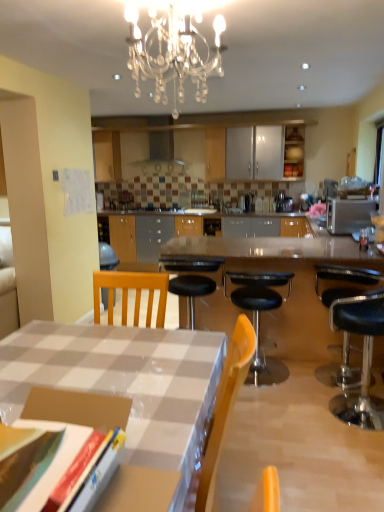
Question: Is polished granite table at center wider or thinner than matte wood cabinet at upper center?

Choices:
 (A) thin
 (B) wide

Answer: (B)

Question: From their relative heights in the image, would you say polished granite table at center is taller or shorter than matte wood cabinet at upper center?

Choices:
 (A) short
 (B) tall

Answer: (B)

Question: Based on their relative distances, which object is farther from the crystal glass chandelier at upper center?

Choices:
 (A) polished granite table at center
 (B) satin silver metallic exhaust hood at upper center
 (C) black leather stool at right, the 2th chair in the left-to-right sequence
 (D) white glossy desk at lower left
 (E) silver metallic microwave at right

Answer: (B)

Question: Which object is the closest to the black leather stool at right, the 1th chair in the right-to-left sequence?

Choices:
 (A) satin silver metallic exhaust hood at upper center
 (B) crystal glass chandelier at upper center
 (C) polished granite table at center
 (D) silver metallic microwave at right
 (E) white glossy desk at lower left

Answer: (C)